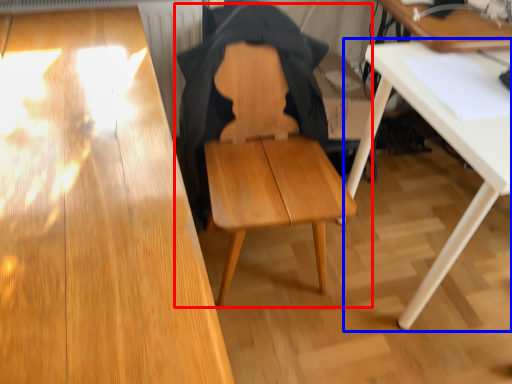
Question: Which object appears closest to the camera in this image, chair (highlighted by a red box) or table (highlighted by a blue box)?

Choices:
 (A) chair
 (B) table

Answer: (A)